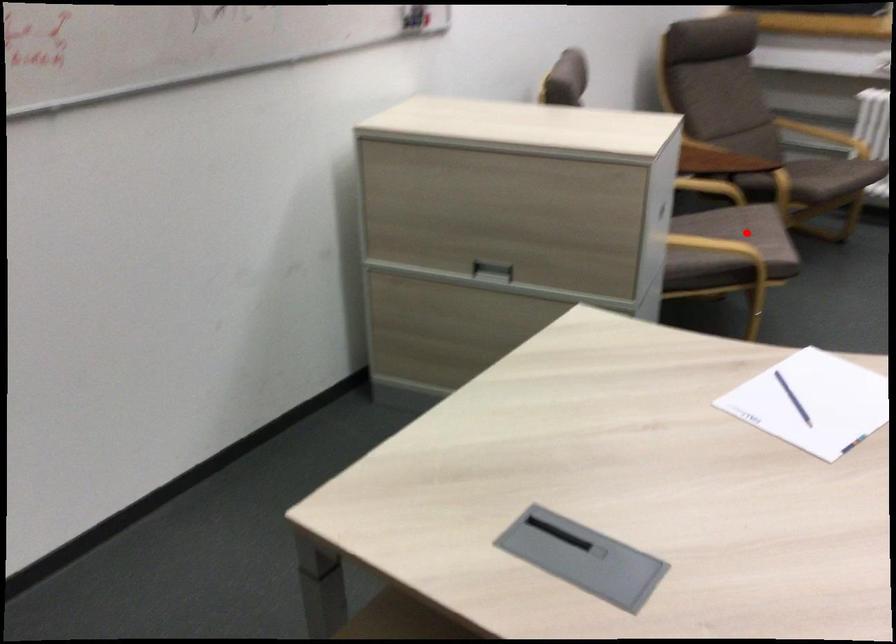
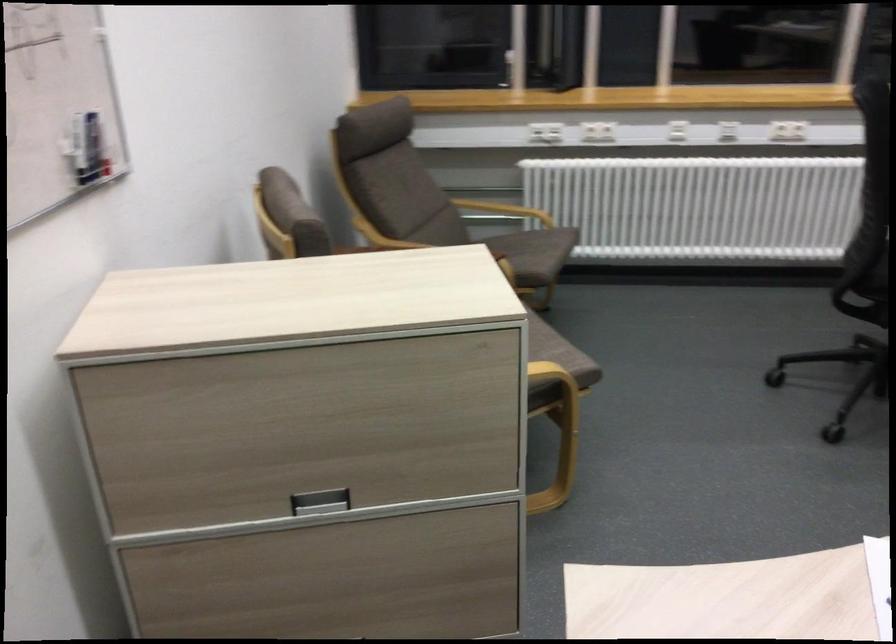
Question: I am providing you with two images of the same scene from different viewpoints. A red point is marked on the first image. Can you still see the location of the red point in image 2?

Choices:
 (A) Yes
 (B) No

Answer: (B)